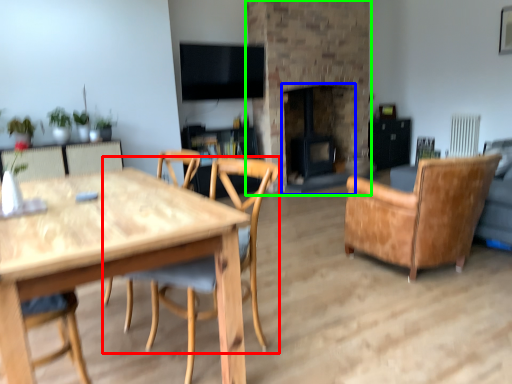
Question: Considering the real-world distances, which object is closest to chair (highlighted by a red box)? fireplace (highlighted by a blue box) or fireplace (highlighted by a green box).

Choices:
 (A) fireplace
 (B) fireplace

Answer: (A)